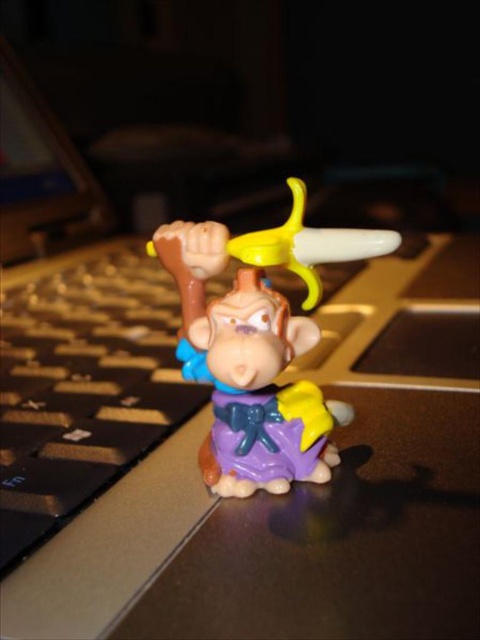
You are organizing a desk and need to place both the black plastic keyboard at left and the matte plastic monkey at center. If you want to ensure that the keyboard fits entirely on the desk without overhanging, which object should you measure the desk space against?

You should measure the desk space against the black plastic keyboard at left because it might be wider than the matte plastic monkey at center, ensuring the keyboard fits without overhanging.

You are organizing items on a desk and need to place a small sticker between the black plastic keyboard at left and the matte plastic monkey at center. Based on their positions, where should you place the sticker?

The sticker should be placed between the black plastic keyboard at left and the matte plastic monkey at center, as the black plastic keyboard at left is positioned to the left of the matte plastic monkey at center.

You are setting up a small figurine on your laptop keyboard. You have a matte plastic monkey at center and a black plastic keyboard at left. Which object is taller?

The black plastic keyboard at left is taller than the matte plastic monkey at center according to the description.